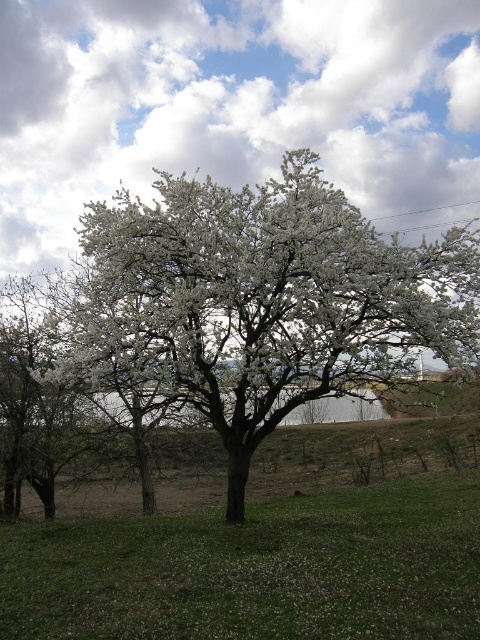
You are a gardener who needs to water the white blossoming tree at center and the green grassy at lower left. Your watering can holds enough water for 5 meters of travel. If you start at the tree, can you reach the grassy area without refilling?

The white blossoming tree at center and green grassy at lower left are 4.76 meters apart. Since the watering can allows for 5 meters of travel, you can reach the grassy area without needing to refill.

Based on the photo, you are a gardener planning to plant a new tree in your backyard. You want to ensure there is enough space between the new tree and the existing green grassy area at lower left. Based on the image, how does the width of the white blossoming tree at center compare to the green grassy at lower left?

The white blossoming tree at center is narrower than the green grassy at lower left, so there should be sufficient space between them.

You are a gardener standing at the green grassy at lower left and want to reach the white blossoming tree at center. Which direction should you walk to get there?

The white blossoming tree at center is positioned on the right side of green grassy at lower left, so you should walk to the right to reach it.